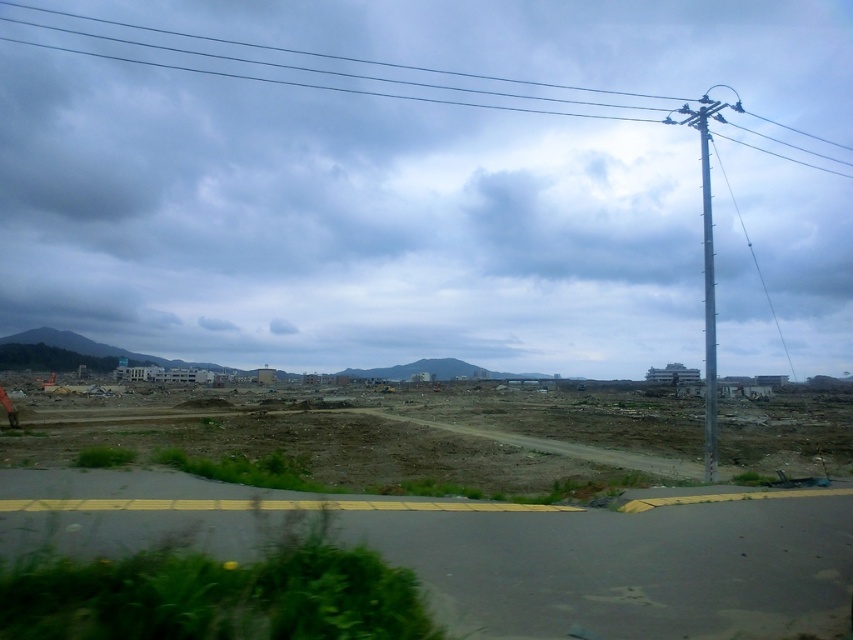
You are a drone operator trying to navigate a small drone through the area shown in the image. The drone has a height limit of 0.4 units. There is a metallic wire at upper center represented by point (335, 54). Can the drone safely pass under the metallic wire at upper center without exceeding its height limit?

The metallic wire at upper center is represented by point (335, 54). Since the drone has a height limit of 0.4 units, it can safely pass under the metallic wire at upper center as its height coordinate is 0.394, which is below the drone height limit.

You are a photographer planning to capture the cloudy sky at upper center and the silver metallic telegraph pole at right in a single shot. Given that your camera frame can only accommodate one of them fully, which object should you prioritize to ensure it fits entirely within the shot?

The cloudy sky at upper center should be prioritized because its width is larger than the silver metallic telegraph pole at right, making it harder to fit within the camera frame if not centered properly.

You are a drone operator planning to fly a drone with a wingspan of 1 meter between the metallic wire at upper center and the silver metallic telegraph pole at right. Based on the scene, can the drone safely pass through the space between them without hitting either object?

The metallic wire at upper center occupies less space than the silver metallic telegraph pole at right, so the space between them is sufficient for the drone with a 1 meter wingspan to pass safely.